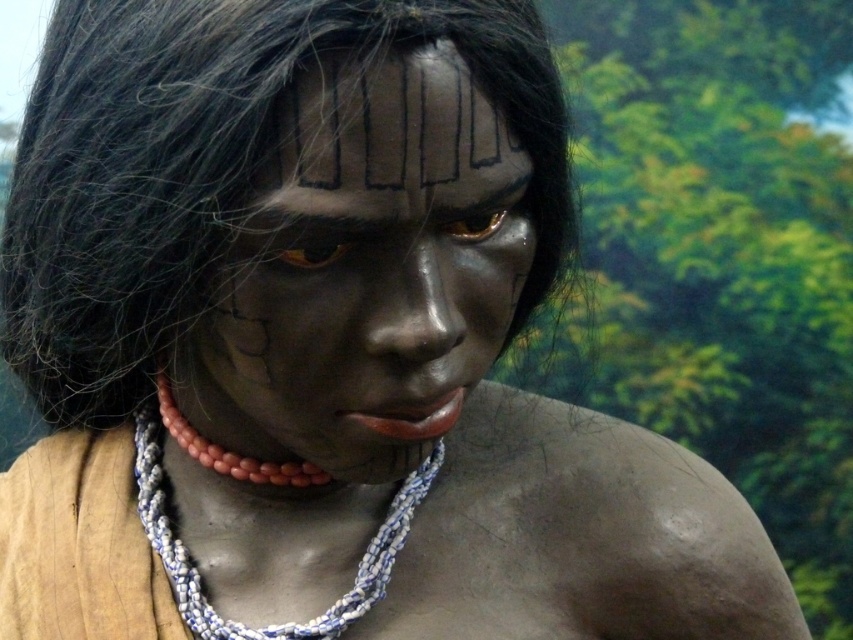
Based on the scene description, can you determine the spatial relationship between the matte black face at center and the blue and white beaded necklace at center?

The matte black face at center is above the blue and white beaded necklace at center.

You are standing 26.37 inches away from a point marked at coordinates point (288, 228). If you take one step forward, will you be closer to the point?

Yes, taking one step forward would decrease your distance to the point (288, 228), making you closer.